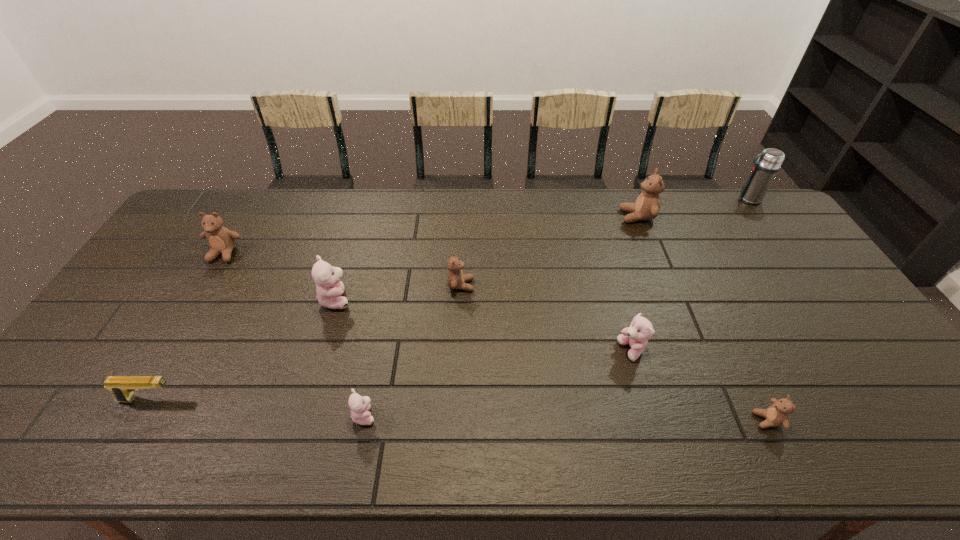
Where is `free spot located 0.100m on the front-facing side of the tallest teddy bear`? This screenshot has height=540, width=960. free spot located 0.100m on the front-facing side of the tallest teddy bear is located at coordinates (592, 217).

The width and height of the screenshot is (960, 540). Identify the location of vacant space located 0.200m on the front-facing side of the tallest teddy bear. click(564, 217).

Where is `free space located on the front-facing side of the tallest teddy bear`? free space located on the front-facing side of the tallest teddy bear is located at coordinates (598, 217).

I want to click on vacant space situated 0.100m at the face of the leftmost pink teddy bear, so click(x=386, y=299).

Identify the location of free region located on the front-facing side of the third farthest object. (203, 290).

Locate an element on the screen. The width and height of the screenshot is (960, 540). free region located on the front-facing side of the fifth object from left to right is located at coordinates click(607, 285).

Locate an element on the screen. The height and width of the screenshot is (540, 960). vacant space located at the face of the fifth farthest teddy bear is located at coordinates (591, 350).

The width and height of the screenshot is (960, 540). I want to click on vacant space positioned at the face of the fifth farthest teddy bear, so click(512, 350).

Identify the location of vacant point located at the face of the fifth farthest teddy bear. Image resolution: width=960 pixels, height=540 pixels. (x=572, y=350).

Locate an element on the screen. The image size is (960, 540). free location located 0.200m at the barrel of the tan pistol is located at coordinates (263, 400).